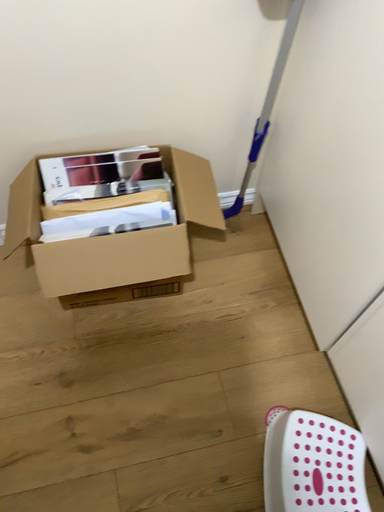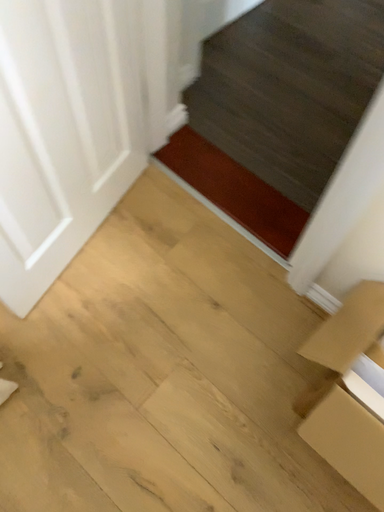
Question: How did the camera likely rotate when shooting the video?

Choices:
 (A) rotated right
 (B) rotated left

Answer: (B)